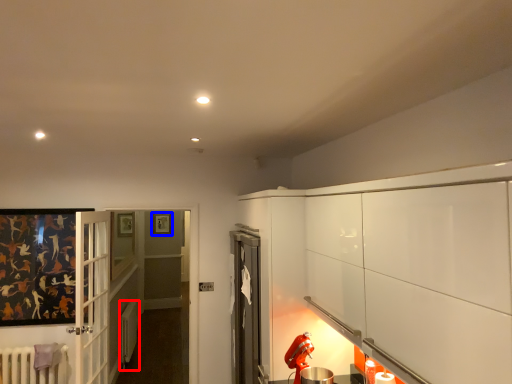
Question: Which object is further to the camera taking this photo, radiator (highlighted by a red box) or picture frame (highlighted by a blue box)?

Choices:
 (A) radiator
 (B) picture frame

Answer: (B)